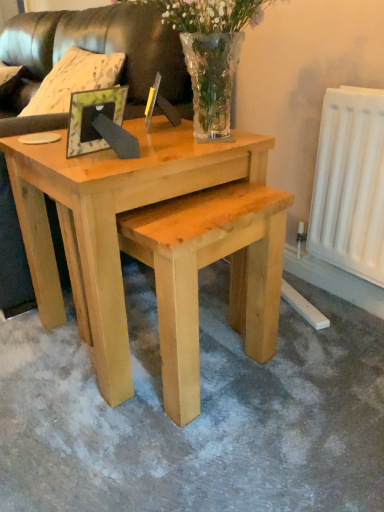
Question: Should I look upward or downward to see leather couch at upper left, the 1th couch from the front?

Choices:
 (A) down
 (B) up

Answer: (B)

Question: Is leather couch at upper left, the 1th couch from the front, thinner than clear glass vase at upper center?

Choices:
 (A) no
 (B) yes

Answer: (A)

Question: Is leather couch at upper left, placed as the 2th couch when sorted from back to front, oriented towards clear glass vase at upper center?

Choices:
 (A) yes
 (B) no

Answer: (B)

Question: From the image's perspective, is leather couch at upper left, placed as the 2th couch when sorted from back to front, over clear glass vase at upper center?

Choices:
 (A) no
 (B) yes

Answer: (B)

Question: Is leather couch at upper left, the 1th couch from the front, wider than clear glass vase at upper center?

Choices:
 (A) yes
 (B) no

Answer: (A)

Question: Can you confirm if leather couch at upper left, placed as the 2th couch when sorted from back to front, is bigger than clear glass vase at upper center?

Choices:
 (A) no
 (B) yes

Answer: (B)

Question: Is leather couch at upper left, placed as the 2th couch when sorted from back to front, at the left side of clear glass vase at upper center?

Choices:
 (A) yes
 (B) no

Answer: (A)

Question: Can you confirm if leather couch at upper left, which is the 2th couch in front-to-back order, is shorter than natural wood coffee table at center?

Choices:
 (A) no
 (B) yes

Answer: (B)

Question: Is leather couch at upper left, the first couch viewed from the back, to the right of natural wood coffee table at center from the viewer's perspective?

Choices:
 (A) yes
 (B) no

Answer: (B)

Question: From a real-world perspective, is leather couch at upper left, which is the 2th couch in front-to-back order, positioned over natural wood coffee table at center based on gravity?

Choices:
 (A) yes
 (B) no

Answer: (A)

Question: Considering the relative sizes of leather couch at upper left, which is the 2th couch in front-to-back order, and natural wood coffee table at center in the image provided, is leather couch at upper left, which is the 2th couch in front-to-back order, bigger than natural wood coffee table at center?

Choices:
 (A) no
 (B) yes

Answer: (A)

Question: Is leather couch at upper left, the first couch viewed from the back, further to camera compared to natural wood coffee table at center?

Choices:
 (A) no
 (B) yes

Answer: (B)

Question: Considering the relative sizes of leather couch at upper left, which is the 2th couch in front-to-back order, and clear glass vase at upper center in the image provided, is leather couch at upper left, which is the 2th couch in front-to-back order, taller than clear glass vase at upper center?

Choices:
 (A) yes
 (B) no

Answer: (A)